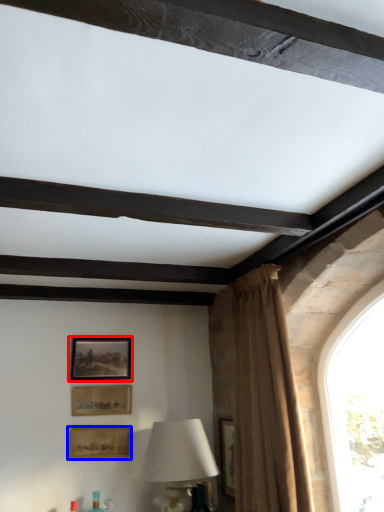
Question: Among these objects, which one is farthest to the camera, picture frame (highlighted by a red box) or picture frame (highlighted by a blue box)?

Choices:
 (A) picture frame
 (B) picture frame

Answer: (A)